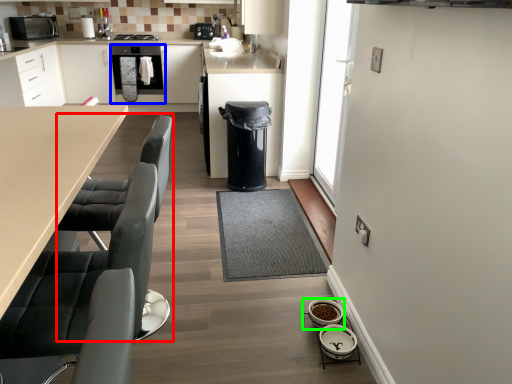
Question: Estimate the real-world distances between objects in this image. Which object is closer to swivel chair (highlighted by a red box), oven (highlighted by a blue box) or appliance (highlighted by a green box)?

Choices:
 (A) oven
 (B) appliance

Answer: (B)